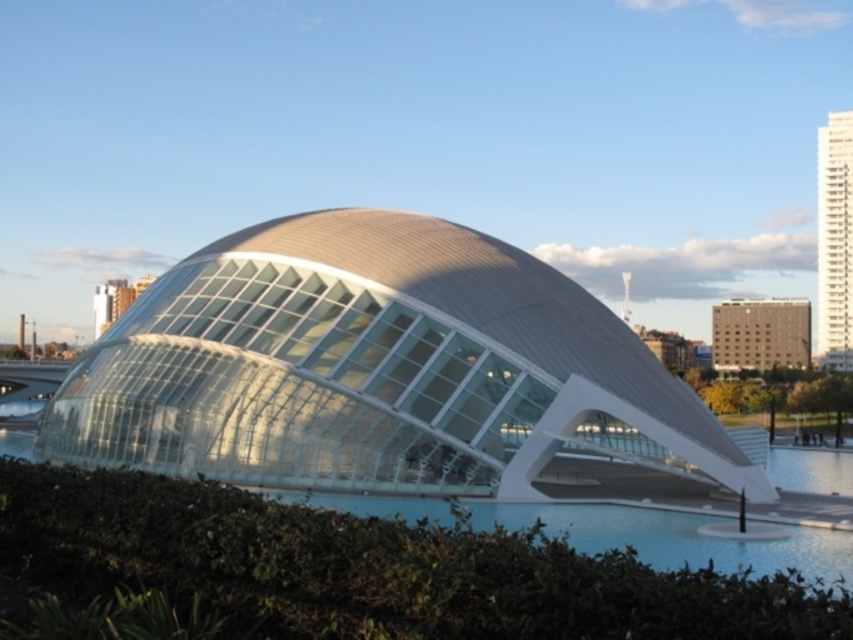
Question: Which point is farther from the camera taking this photo?

Choices:
 (A) (822, 332)
 (B) (613, 522)
 (C) (61, 545)

Answer: (A)

Question: Does white glass dome at center have a smaller size compared to white glass building at upper right?

Choices:
 (A) no
 (B) yes

Answer: (A)

Question: Is the position of clear blue water at center less distant than that of beige concrete building at upper right?

Choices:
 (A) yes
 (B) no

Answer: (A)

Question: Which of the following is the farthest from the observer?

Choices:
 (A) (822, 157)
 (B) (370, 509)
 (C) (589, 381)
 (D) (743, 346)

Answer: (A)

Question: Which point appears farthest from the camera in this image?

Choices:
 (A) (706, 577)
 (B) (502, 513)

Answer: (B)

Question: Does white glass dome at center appear on the right side of clear blue water at center?

Choices:
 (A) yes
 (B) no

Answer: (B)